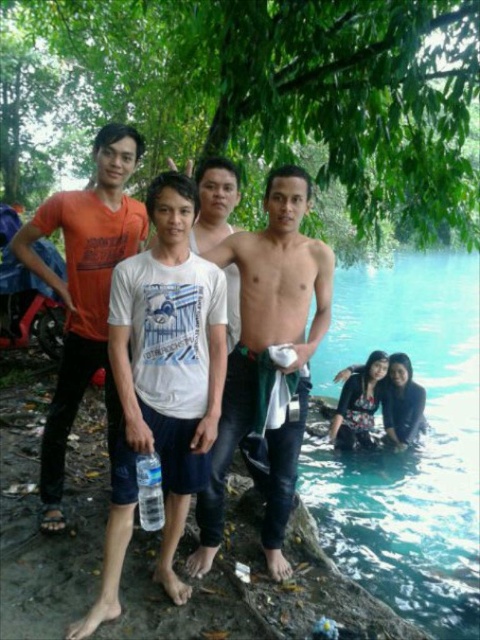
Does orange cotton t-shirt at left come behind muscular tan skin at center?

Yes, orange cotton t-shirt at left is further from the viewer.

You are a GUI agent. You are given a task and a screenshot of the screen. Output one action in this format:
    pyautogui.click(x=<x>, y=<y>)
    Task: Click on the orange cotton t-shirt at left
    Image resolution: width=480 pixels, height=640 pixels.
    Given the screenshot: What is the action you would take?
    pyautogui.click(x=84, y=289)

The height and width of the screenshot is (640, 480). Identify the location of orange cotton t-shirt at left. pyautogui.click(x=84, y=289).

Is shiny metallic towel at center below muscular tan skin at center?

Correct, shiny metallic towel at center is located below muscular tan skin at center.

Can you confirm if shiny metallic towel at center is taller than muscular tan skin at center?

Yes.

Who is more distant from viewer, (224, 264) or (307, 312)?

Point (307, 312)

Locate an element on the screen. The height and width of the screenshot is (640, 480). shiny metallic towel at center is located at coordinates (264, 324).

How much distance is there between orange cotton t-shirt at left and clear plastic bottle at lower center?

90.54 centimeters

Does orange cotton t-shirt at left have a lesser height compared to clear plastic bottle at lower center?

No, orange cotton t-shirt at left is not shorter than clear plastic bottle at lower center.

In order to click on orange cotton t-shirt at left in this screenshot , I will do `click(84, 289)`.

The height and width of the screenshot is (640, 480). What are the coordinates of `orange cotton t-shirt at left` in the screenshot? It's located at (84, 289).